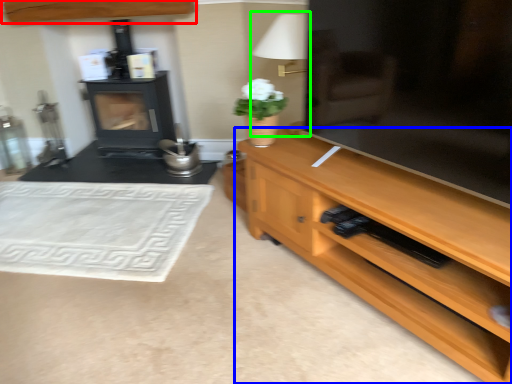
Question: Which is nearer to the cabinetry (highlighted by a red box)? desk (highlighted by a blue box) or table lamp (highlighted by a green box).

Choices:
 (A) desk
 (B) table lamp

Answer: (B)